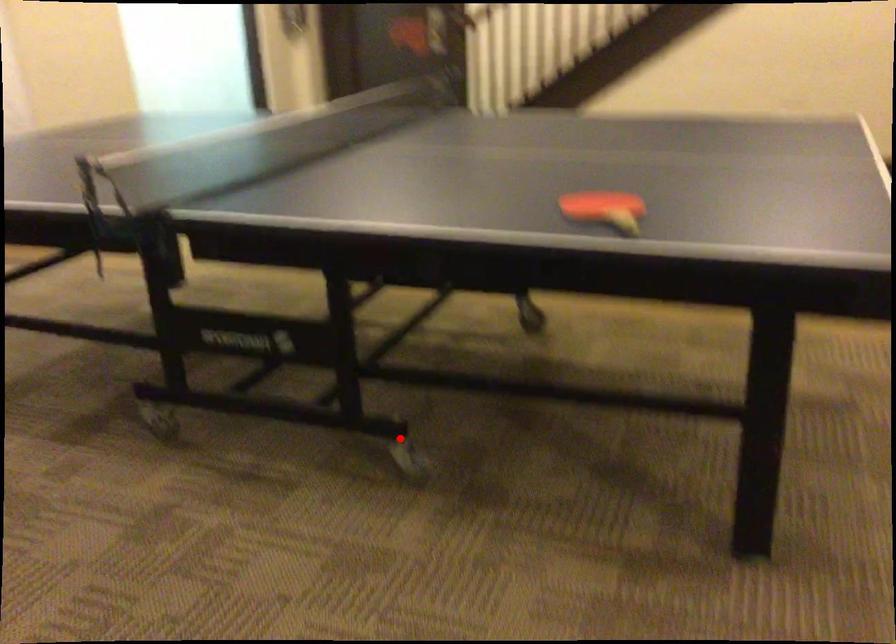
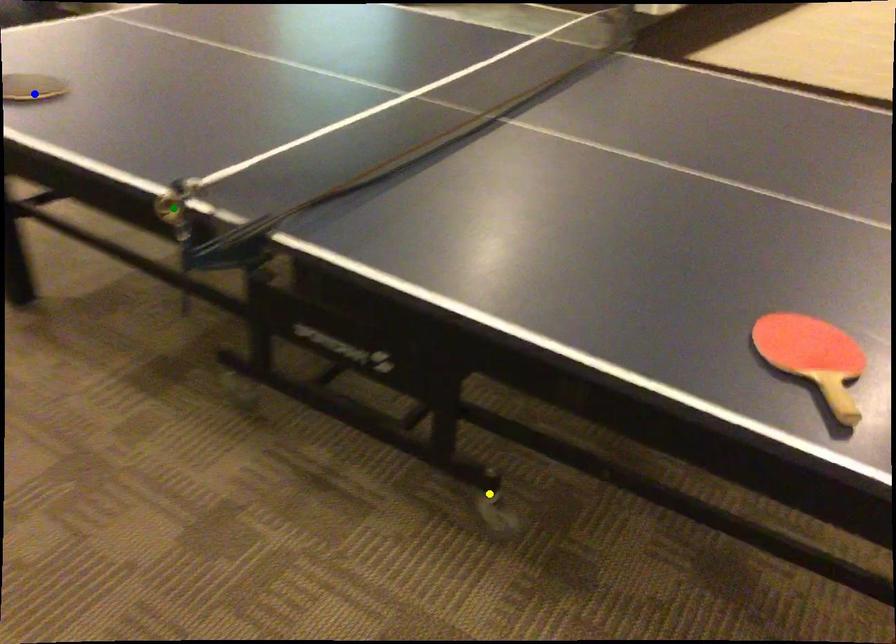
Question: I am providing you with two images of the same scene from different viewpoints. A red point is marked on the first image. You are given multiple points on the second image. Which point in image 2 represents the same 3d spot as the red point in image 1?

Choices:
 (A) blue point
 (B) green point
 (C) yellow point

Answer: (C)